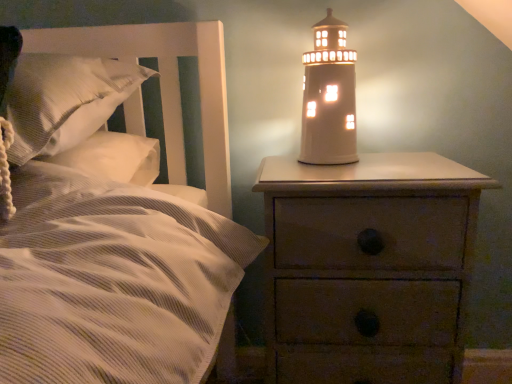
Find the location of a particular element. The image size is (512, 384). spots to the right of white ceramic lighthouse at upper right is located at coordinates (412, 162).